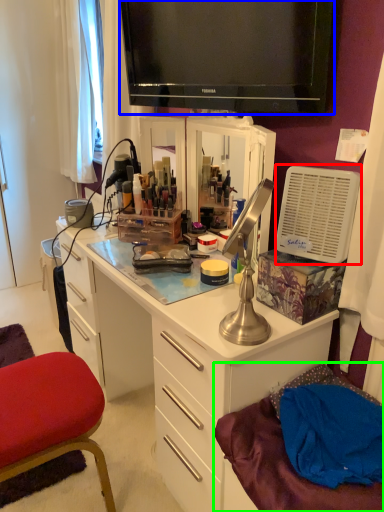
Question: Considering the real-world distances, which object is closest to appliance (highlighted by a red box)? television (highlighted by a blue box) or wide (highlighted by a green box).

Choices:
 (A) television
 (B) wide

Answer: (A)